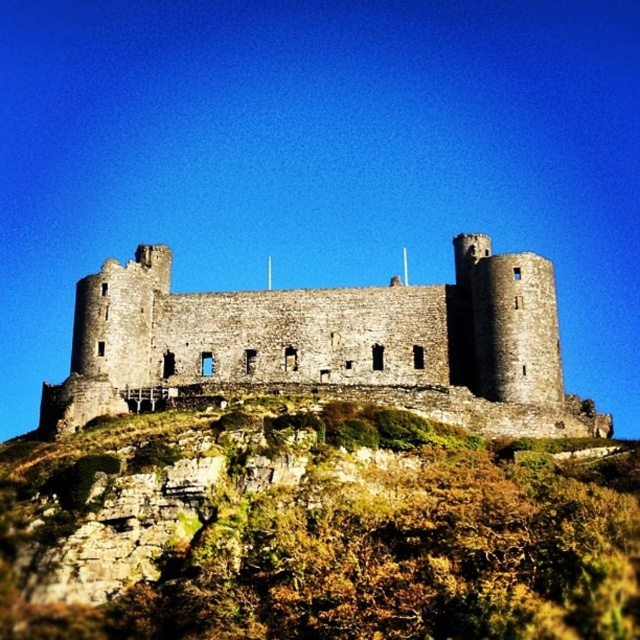
Question: Which point appears farthest from the camera in this image?

Choices:
 (A) (600, 426)
 (B) (572, 504)

Answer: (A)

Question: Can you confirm if green mossy rock at center is positioned to the right of stone castle at center?

Choices:
 (A) yes
 (B) no

Answer: (B)

Question: Where is green mossy rock at center located in relation to stone castle at center in the image?

Choices:
 (A) below
 (B) above

Answer: (A)

Question: Does green mossy rock at center have a smaller size compared to stone castle at center?

Choices:
 (A) no
 (B) yes

Answer: (B)

Question: Which of the following is the farthest from the observer?

Choices:
 (A) green mossy rock at center
 (B) stone castle at center

Answer: (B)

Question: Which point is closer to the camera?

Choices:
 (A) (104, 268)
 (B) (452, 600)

Answer: (B)